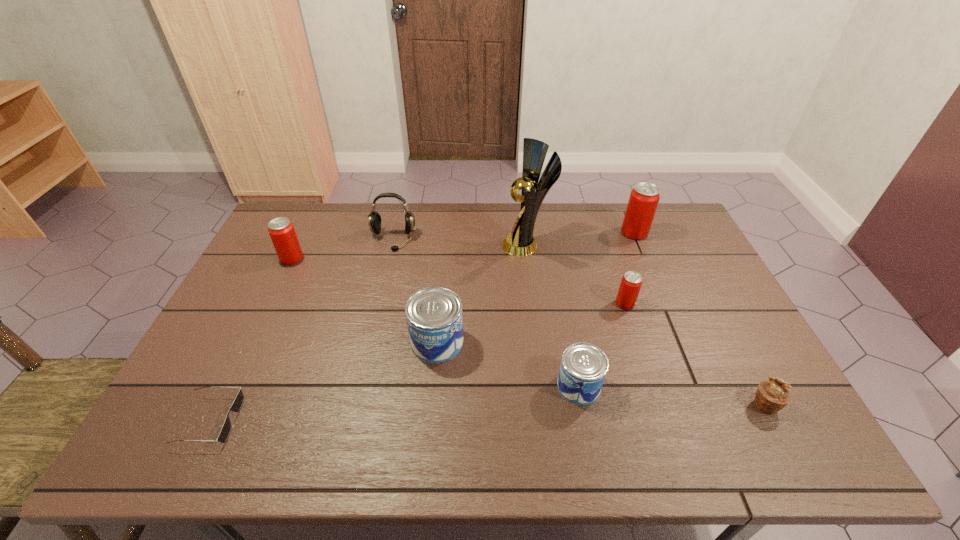
Identify the location of black award. (520, 243).

Identify the location of award. (520, 243).

The width and height of the screenshot is (960, 540). I want to click on the second object from right to left, so click(644, 198).

Find the location of a particular element. The height and width of the screenshot is (540, 960). the farthest red can is located at coordinates point(644,198).

Locate an element on the screen. headset is located at coordinates pos(374,220).

This screenshot has width=960, height=540. I want to click on the second smallest red can, so click(x=281, y=230).

Locate an element on the screen. This screenshot has height=540, width=960. the leftmost red can is located at coordinates (281, 230).

At what (x,y) coordinates should I click in order to perform the action: click on the sixth farthest object. Please return your answer as a coordinate pair (x, y). Image resolution: width=960 pixels, height=540 pixels. Looking at the image, I should click on (434, 318).

Find the location of a particular element. This screenshot has width=960, height=540. the fourth object from left to right is located at coordinates (x=434, y=318).

At what (x,y) coordinates should I click in order to perform the action: click on the second red can from left to right. Please return your answer as a coordinate pair (x, y). Looking at the image, I should click on (631, 282).